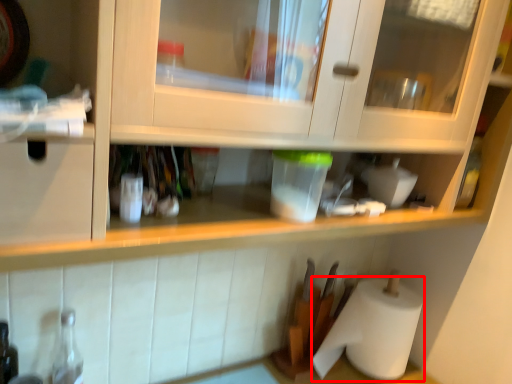
Question: From the image's perspective, where is paper towel (annotated by the red box) located in relation to bottle in the image?

Choices:
 (A) above
 (B) below

Answer: (A)